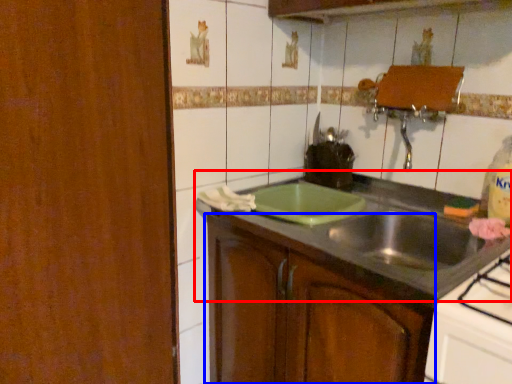
Question: Which of the following is the closest to the observer, countertop (highlighted by a red box) or cabinetry (highlighted by a blue box)?

Choices:
 (A) countertop
 (B) cabinetry

Answer: (A)